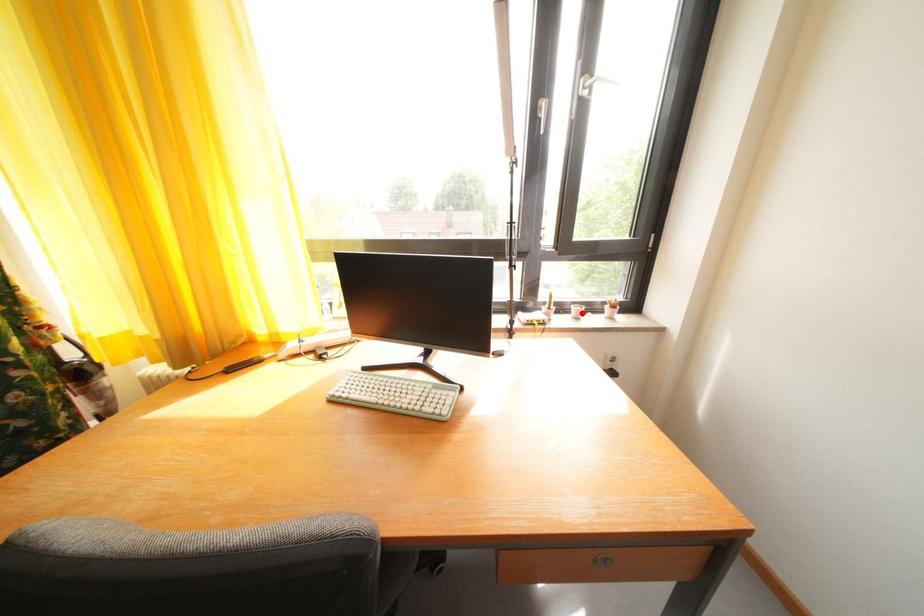
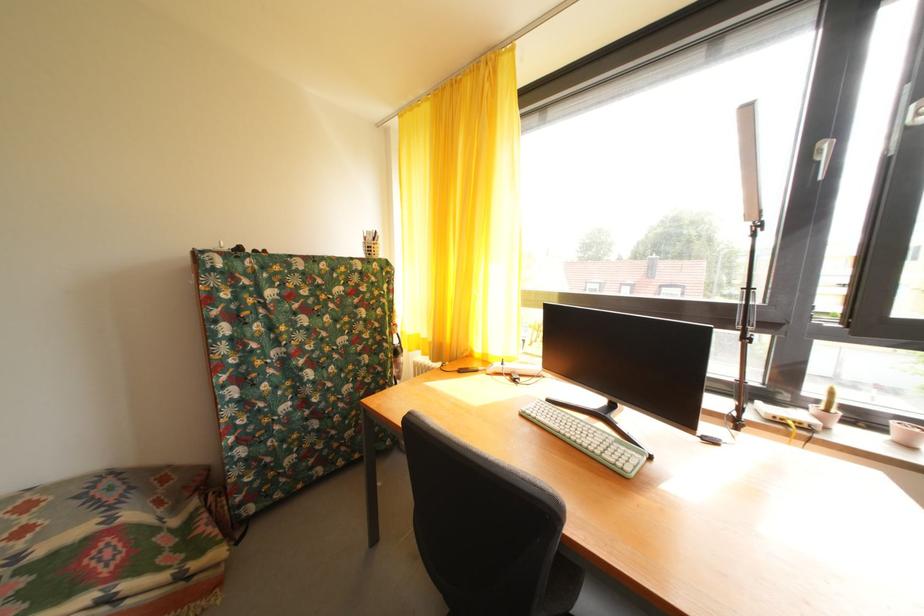
The point at the highlighted location is marked in the first image. Where is the corresponding point in the second image?

(904, 430)